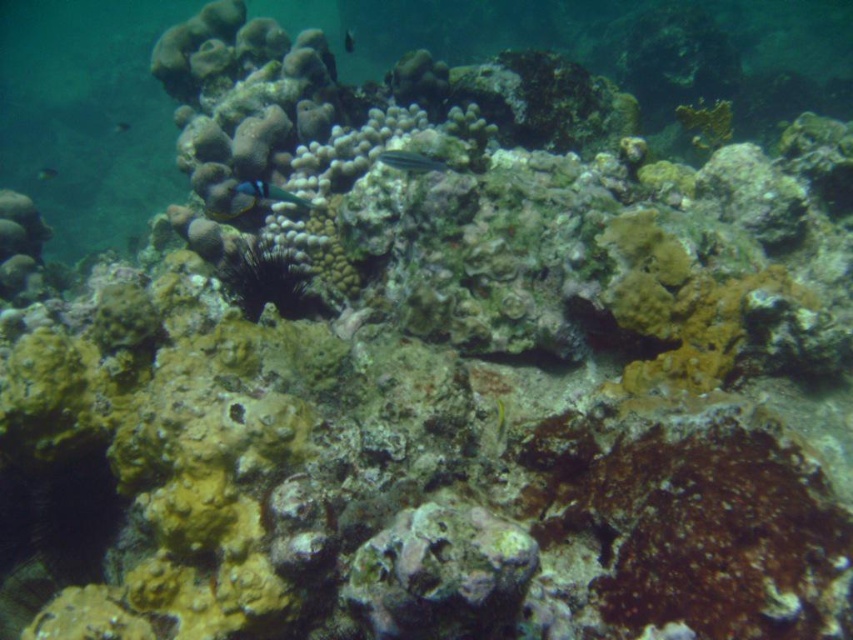
Who is lower down, shiny blue fish at upper center or shiny blue fish at left?

shiny blue fish at left is lower down.

Consider the image. Is shiny blue fish at upper center shorter than shiny blue fish at left?

In fact, shiny blue fish at upper center may be taller than shiny blue fish at left.

Is point (347, 45) positioned before point (53, 177)?

Yes, it is.

This screenshot has height=640, width=853. Identify the location of shiny blue fish at upper center. (347, 40).

Which is in front, point (276, 188) or point (352, 49)?

Point (276, 188) is more forward.

The image size is (853, 640). Identify the location of blue glossy fish at center. (268, 193).

Where is `blue glossy fish at center`? blue glossy fish at center is located at coordinates (268, 193).

Is point (277, 198) more distant than point (51, 172)?

No, it is not.

Does point (305, 202) come behind point (45, 173)?

No.

Image resolution: width=853 pixels, height=640 pixels. I want to click on blue glossy fish at center, so click(x=268, y=193).